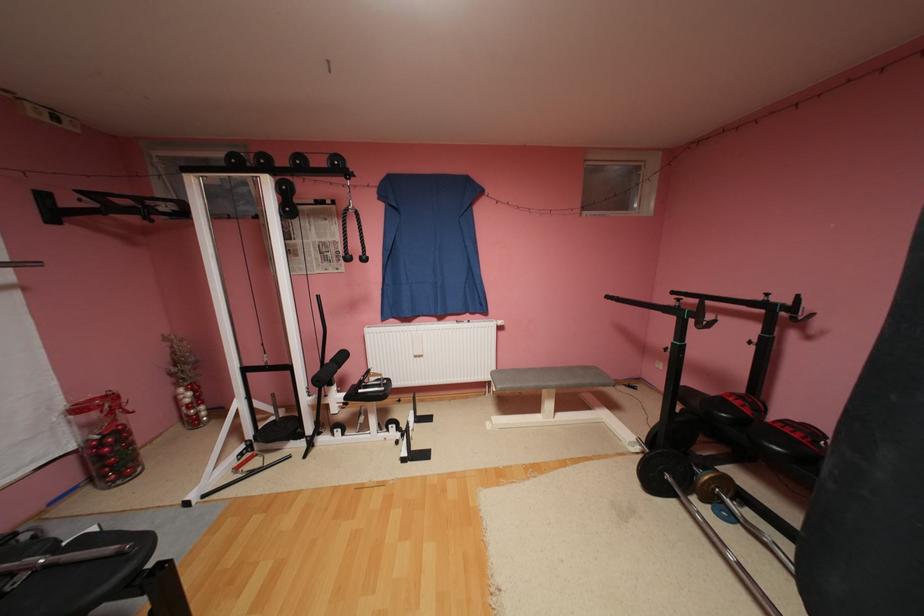
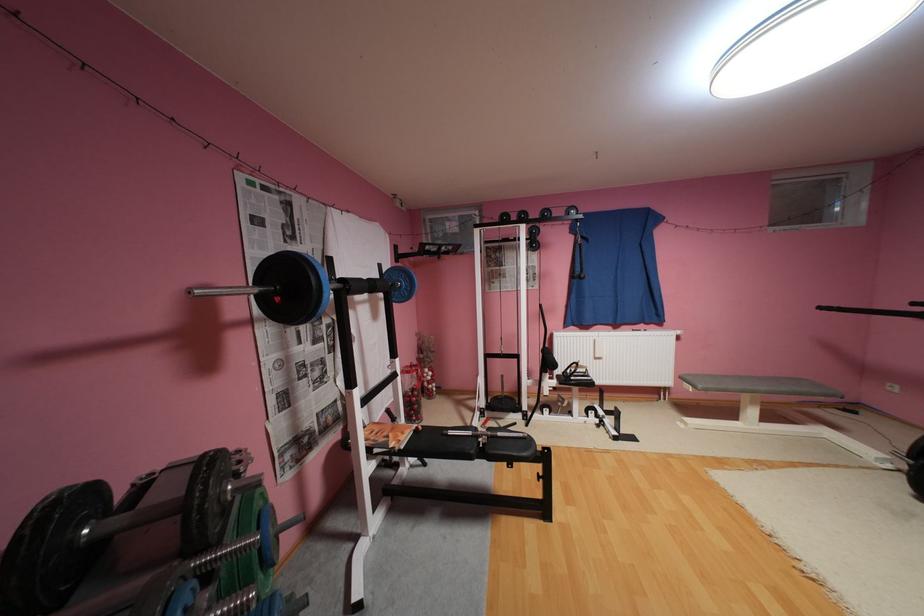
Locate, in the second image, the point that corresponds to point (64, 213) in the first image.

(407, 256)